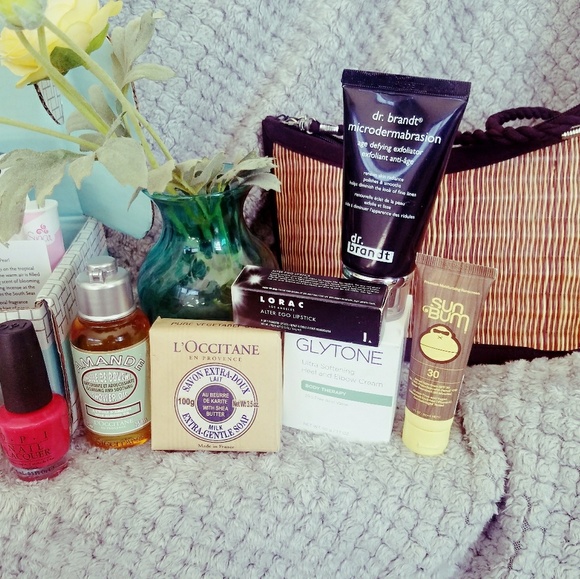
Where is `pot`? The width and height of the screenshot is (580, 579). pot is located at coordinates (183, 233).